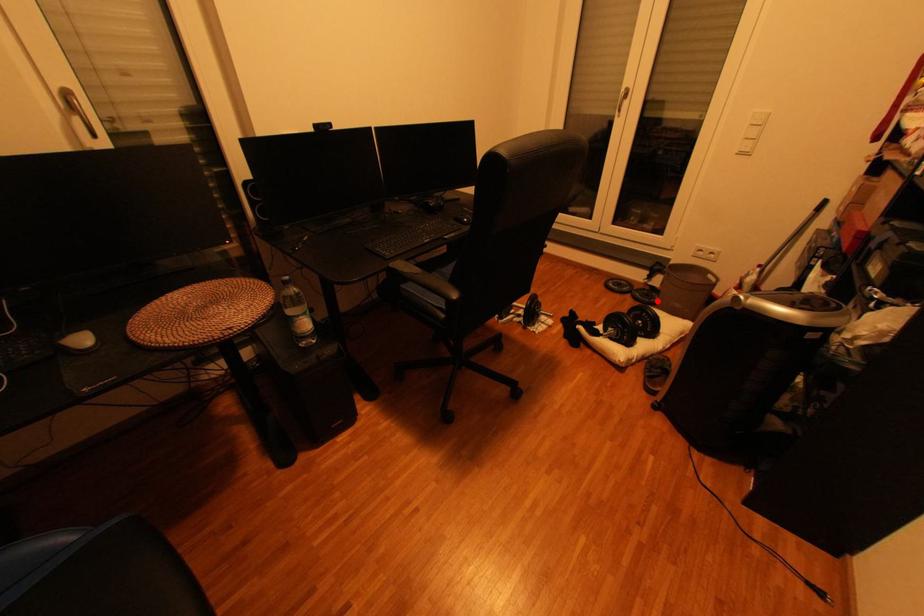
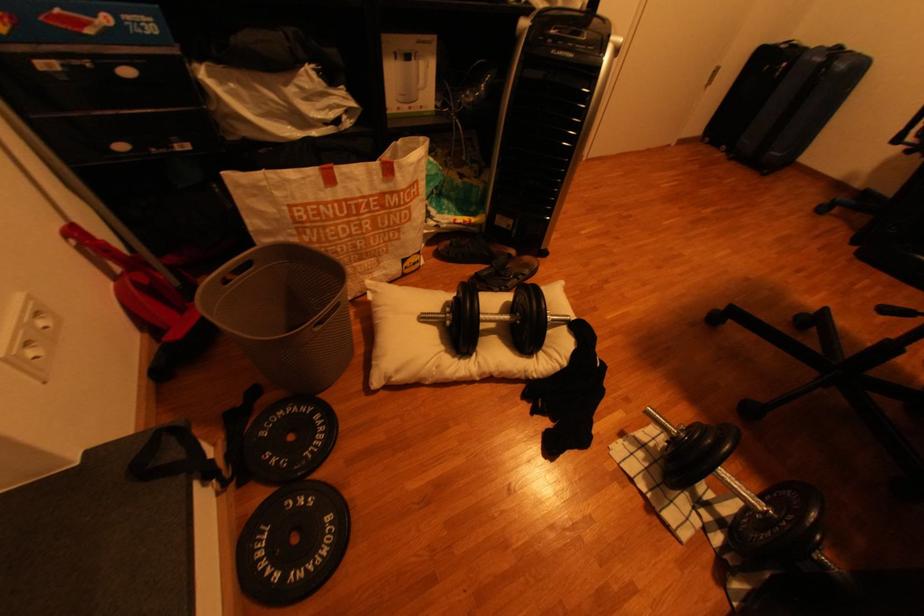
Find the pixel in the second image that matches the highlighted location in the first image.

(325, 419)